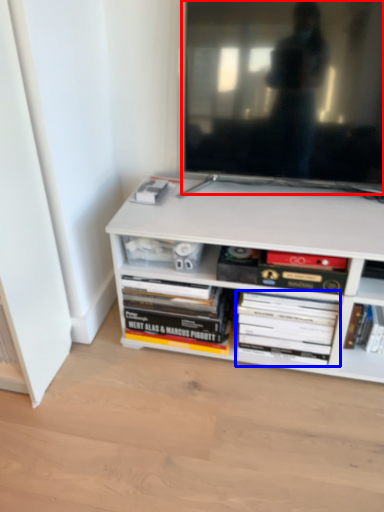
Question: Among these objects, which one is nearest to the camera, television (highlighted by a red box) or book (highlighted by a blue box)?

Choices:
 (A) television
 (B) book

Answer: (A)